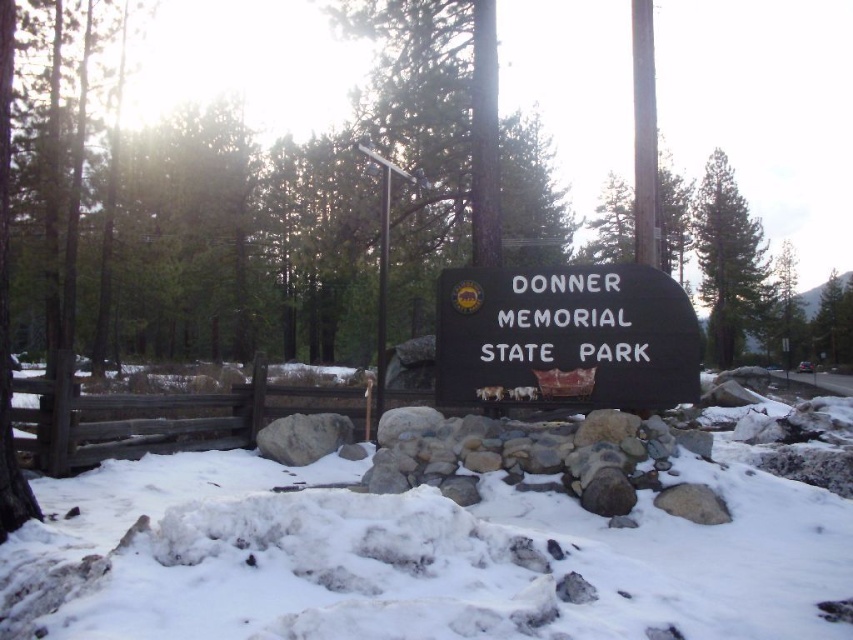
From the picture: You are planning to build a snowman using the white fluffy snow at center and the green textured pine tree at upper right as a reference. Since the pine tree is wider, can you use the snow from the center area to cover the entire base of the pine tree?

The white fluffy snow at center has a lesser width compared to green textured pine tree at upper right. Therefore, the snow area might not be wide enough to cover the entire base of the pine tree, as the pine tree is wider.